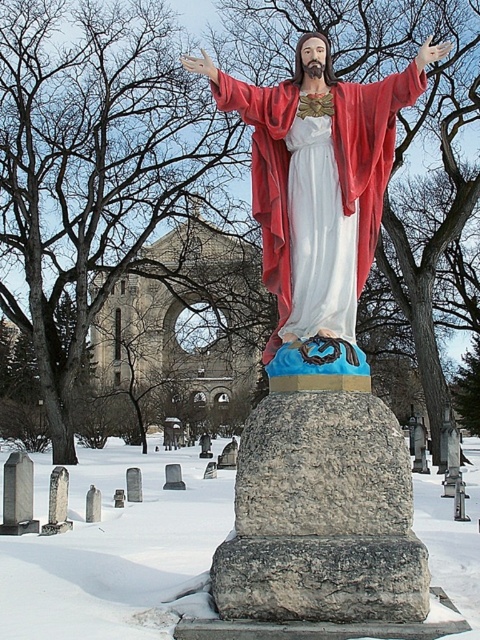
Question: Does gray stone gravestone at center have a greater width compared to white snow at center?

Choices:
 (A) no
 (B) yes

Answer: (A)

Question: Which of the following is the farthest from the observer?

Choices:
 (A) [x=348, y=579]
 (B) [x=273, y=348]

Answer: (B)

Question: Does matte red statue at center come behind gray stone gravestone at center?

Choices:
 (A) no
 (B) yes

Answer: (B)

Question: Which object is the closest to the white snow at center?

Choices:
 (A) velvet red robe at center
 (B) gray stone gravestone at center

Answer: (B)

Question: Where is matte red statue at center located in relation to velvet red robe at center in the image?

Choices:
 (A) right
 (B) left

Answer: (B)

Question: Based on their relative distances, which object is nearer to the velvet red robe at center?

Choices:
 (A) white snow at center
 (B) matte red statue at center

Answer: (B)